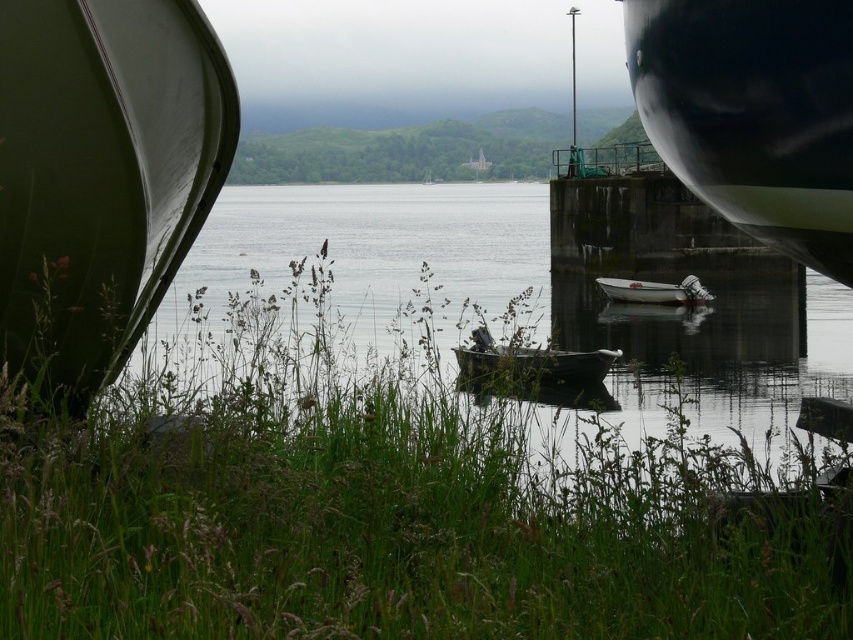
Which is in front, point (527, 362) or point (653, 300)?

Point (527, 362)

Is point (474, 369) closer to camera compared to point (689, 284)?

Yes, it is.

Is point (527, 371) farther from viewer compared to point (610, 280)?

That is False.

Locate an element on the screen. The image size is (853, 640). green matte canoe at center is located at coordinates (532, 364).

Does point (820, 28) come in front of point (463, 346)?

Yes, point (820, 28) is in front of point (463, 346).

Between glossy black boat at right and green matte canoe at center, which one has less height?

green matte canoe at center is shorter.

The width and height of the screenshot is (853, 640). In order to click on glossy black boat at right in this screenshot , I will do `click(753, 113)`.

Between green grass at center and green matte canoe at center, which one is positioned lower?

Positioned lower is green matte canoe at center.

Between point (469, 595) and point (561, 364), which one is positioned behind?

The point (561, 364) is behind.

Where is `green grass at center`? This screenshot has width=853, height=640. green grass at center is located at coordinates (393, 502).